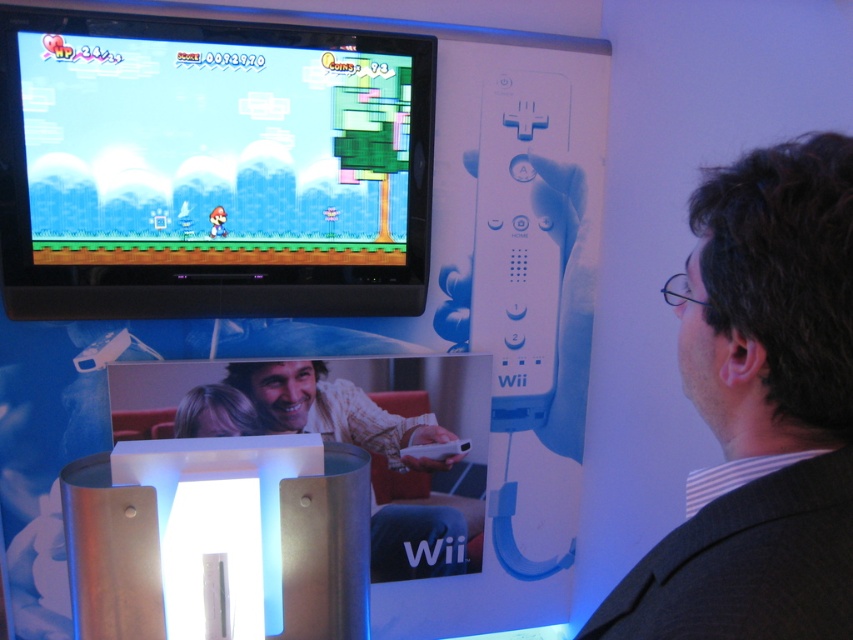
Which of these two, dark brown hair at upper right or blonde hair at center, stands shorter?

With less height is blonde hair at center.

Is dark brown hair at upper right thinner than blonde hair at center?

Yes.

Identify the location of dark brown hair at upper right. The width and height of the screenshot is (853, 640). (759, 410).

Can you confirm if dark brown hair at upper right is shorter than white matte remote at center?

Correct, dark brown hair at upper right is not as tall as white matte remote at center.

Between dark brown hair at upper right and white matte remote at center, which one has less height?

dark brown hair at upper right

Which is in front, point (780, 508) or point (480, 522)?

Point (780, 508)

Find the location of a particular element. The width and height of the screenshot is (853, 640). dark brown hair at upper right is located at coordinates (759, 410).

Is the position of matte plastic screen at upper center more distant than that of blonde hair at center?

No.

Is point (183, 310) more distant than point (180, 404)?

No, it is in front of (180, 404).

Image resolution: width=853 pixels, height=640 pixels. Identify the location of matte plastic screen at upper center. (212, 168).